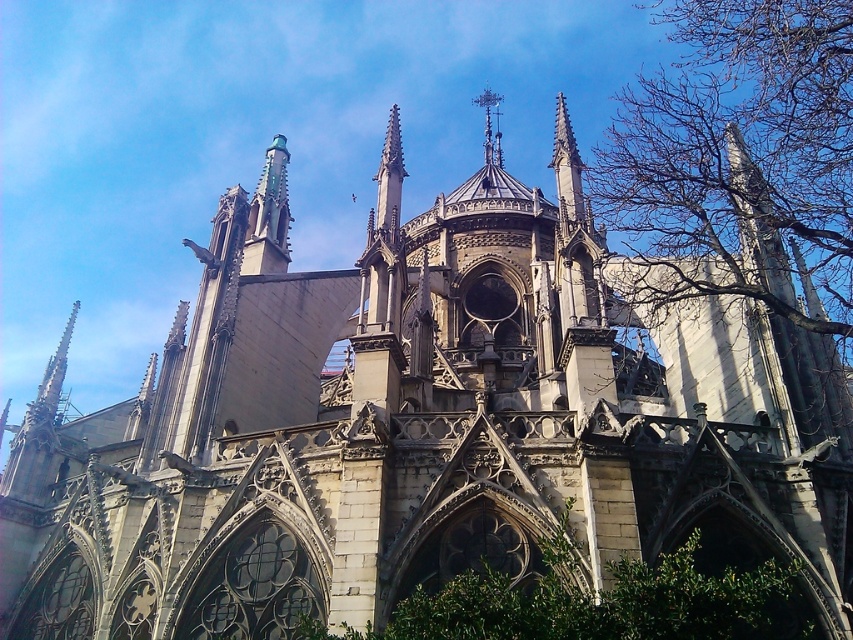
Can you confirm if bare branches at upper right is taller than green leafy bush at lower center?

Indeed, bare branches at upper right has a greater height compared to green leafy bush at lower center.

Between bare branches at upper right and green leafy bush at lower center, which one has more height?

With more height is bare branches at upper right.

What do you see at coordinates (746, 145) in the screenshot? I see `bare branches at upper right` at bounding box center [746, 145].

This screenshot has height=640, width=853. What are the coordinates of `bare branches at upper right` in the screenshot? It's located at (746, 145).